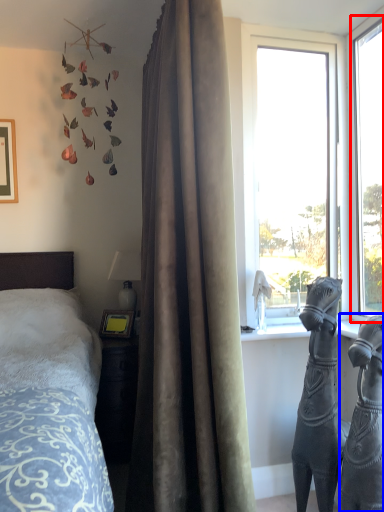
Question: Which of the following is the farthest to the observer, window (highlighted by a red box) or sculpture (highlighted by a blue box)?

Choices:
 (A) window
 (B) sculpture

Answer: (A)